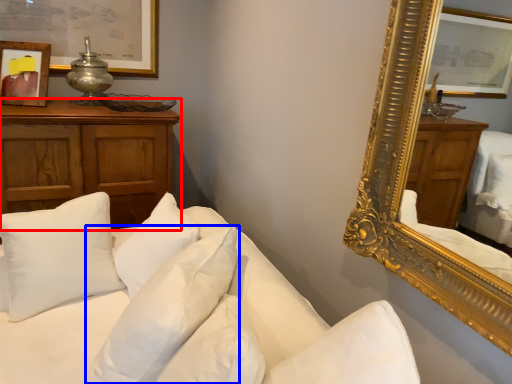
Question: Among these objects, which one is nearest to the camera, cabinetry (highlighted by a red box) or pillow (highlighted by a blue box)?

Choices:
 (A) cabinetry
 (B) pillow

Answer: (B)